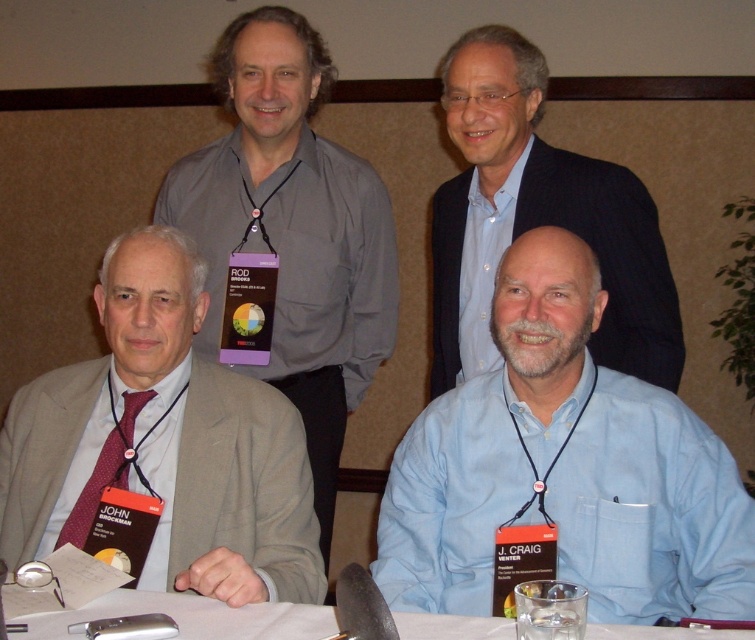
You are a photographer setting up for a group photo in the conference room. You need to position a light source between the two points labeled point (678, 339) and point (72, 520). Which point should the light be closer to in order to ensure it illuminates the area closer to the camera more effectively?

The light should be placed closer to point (678, 339) because it is further to the camera than point (72, 520), so positioning the light nearer to it will better illuminate the foreground area.

You are a photographer setting up for a group photo. You need to ensure that the blue shirt at upper center and the maroon textured tie at lower left are both visible in the frame. Based on their positions, which one might require you to adjust your camera angle to include it?

The maroon textured tie at lower left is shorter than the blue shirt at upper center, so you might need to adjust the camera angle to ensure it is fully visible in the frame.

You are attending a conference and notice two items on the table in front of you. The blue shirt at upper center and the maroon textured tie at lower left. Which item is positioned higher on the table?

The blue shirt at upper center is positioned higher on the table than the maroon textured tie at lower left according to the description provided.